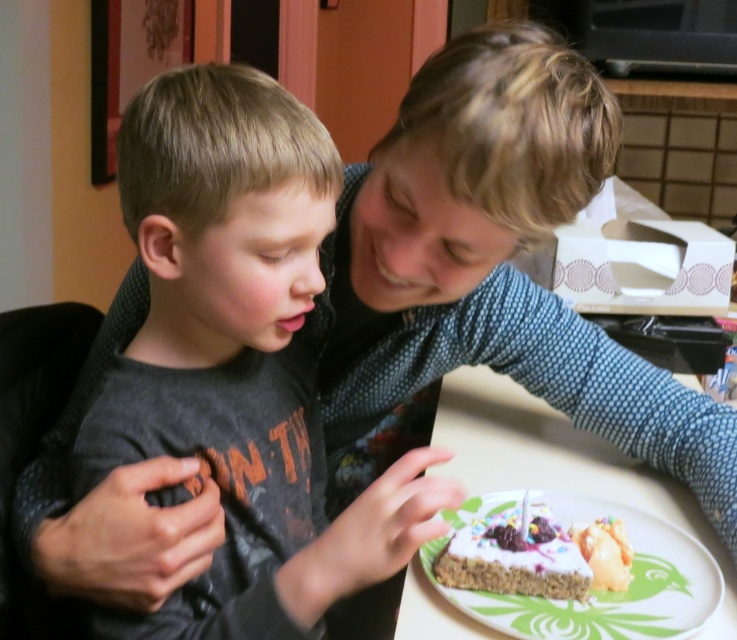
Question: Estimate the real-world distances between objects in this image. Which object is closer to the white frosted cake at center?

Choices:
 (A) white frosted cake at lower center
 (B) dark gray shirt at center

Answer: (A)

Question: Can you confirm if dark gray shirt at center is positioned to the right of white frosted cake at center?

Choices:
 (A) no
 (B) yes

Answer: (A)

Question: Is dark gray shirt at center closer to the viewer compared to white frosted cake at lower center?

Choices:
 (A) no
 (B) yes

Answer: (B)

Question: Which of the following is the farthest from the observer?

Choices:
 (A) white frosted cake at center
 (B) dark gray shirt at center

Answer: (A)

Question: Which point is closer to the camera?

Choices:
 (A) dark gray shirt at center
 (B) white frosted cake at lower center
 (C) white frosted cake at center

Answer: (A)

Question: In this image, where is white frosted cake at lower center located relative to white frosted cake at center?

Choices:
 (A) left
 (B) right

Answer: (B)